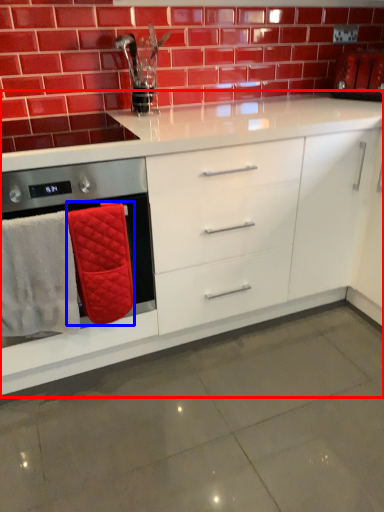
Question: Which object appears farthest to the camera in this image, cabinetry (highlighted by a red box) or bath towel (highlighted by a blue box)?

Choices:
 (A) cabinetry
 (B) bath towel

Answer: (B)